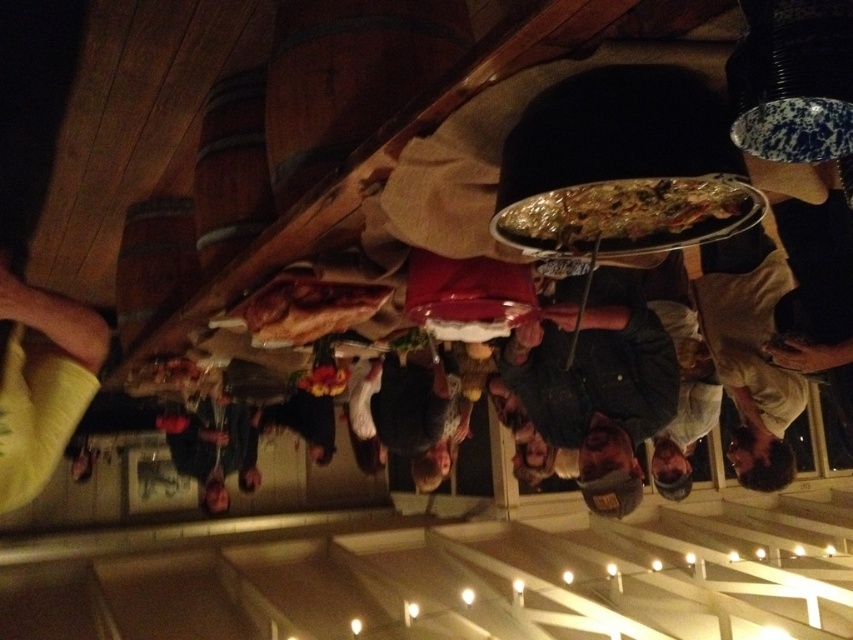
Who is higher up, shiny metallic pizza at center or golden brown crusty bread at center?

shiny metallic pizza at center

Identify the location of shiny metallic pizza at center. This screenshot has height=640, width=853. (630, 216).

Identify the location of shiny metallic pizza at center. The height and width of the screenshot is (640, 853). (630, 216).

Is white cotton shirt at center closer to the viewer compared to shiny metallic pizza at center?

No, it is not.

Which is in front, point (741, 449) or point (595, 205)?

Point (595, 205)

Is point (714, 337) positioned before point (590, 188)?

That is False.

Where is `white cotton shirt at center`? white cotton shirt at center is located at coordinates (763, 346).

Which is behind, point (791, 292) or point (25, 490)?

The point (791, 292) is more distant.

Is point (790, 316) farther from viewer compared to point (86, 362)?

Yes, point (790, 316) is behind point (86, 362).

This screenshot has height=640, width=853. Identify the location of white cotton shirt at center. pyautogui.click(x=763, y=346).